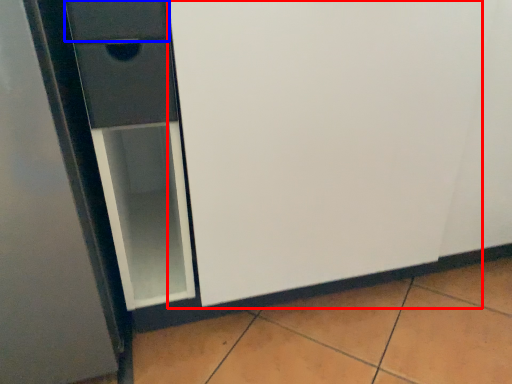
Question: Which object is further to the camera taking this photo, screen door (highlighted by a red box) or drawer (highlighted by a blue box)?

Choices:
 (A) screen door
 (B) drawer

Answer: (B)